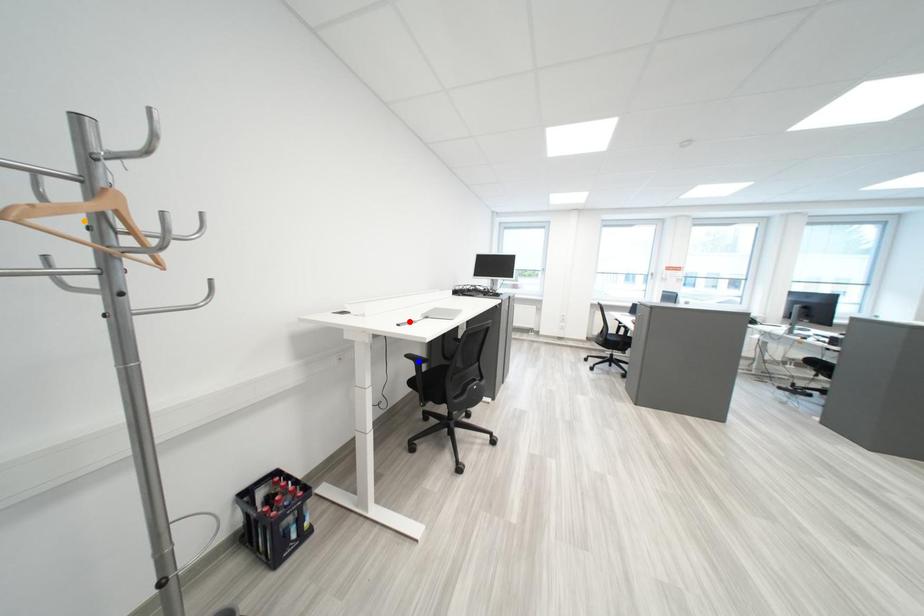
Looking at this image, order these from nearest to farthest:
red point | orange point | blue point

1. blue point
2. red point
3. orange point